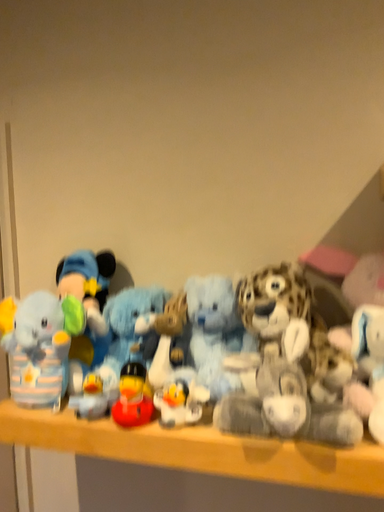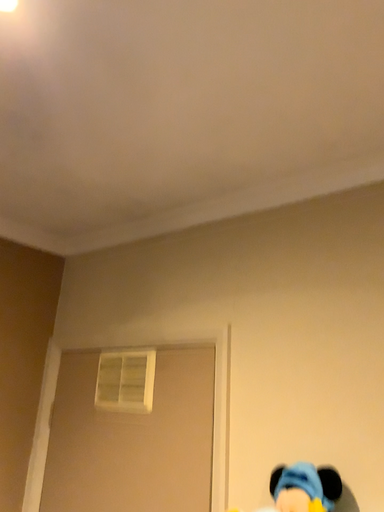
Question: How did the camera likely rotate when shooting the video?

Choices:
 (A) rotated upward
 (B) rotated downward

Answer: (A)